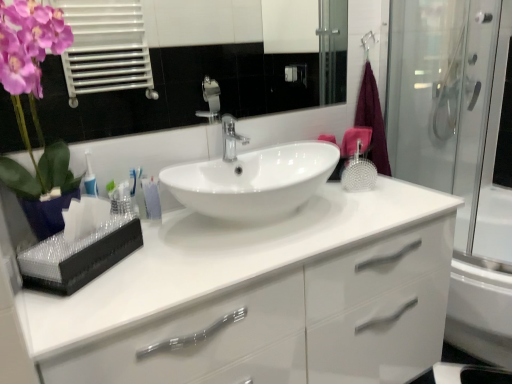
What is the approximate width of translucent plastic toothbrushes at left?

The width of translucent plastic toothbrushes at left is 1.85 inches.

This screenshot has height=384, width=512. What do you see at coordinates (455, 112) in the screenshot?
I see `transparent glass shower door at right` at bounding box center [455, 112].

In order to face white glossy cabinet at center, should I rotate leftwards or rightwards?

You should rotate right by 1.140 degrees.

The width and height of the screenshot is (512, 384). Describe the element at coordinates (252, 178) in the screenshot. I see `white glossy sink at center` at that location.

This screenshot has width=512, height=384. Identify the location of translucent plastic toothbrushes at left. (151, 198).

This screenshot has width=512, height=384. In the image, there is a glossy ceramic mirror at upper center. What are the coordinates of `tap below it (from a real-world perspective)` in the screenshot? It's located at (231, 138).

Looking at this image, considering the sizes of objects polished chrome faucet at center and glossy ceramic mirror at upper center in the image provided, who is shorter, polished chrome faucet at center or glossy ceramic mirror at upper center?

polished chrome faucet at center is shorter.

Is polished chrome faucet at center wider than glossy ceramic mirror at upper center?

Yes, polished chrome faucet at center is wider than glossy ceramic mirror at upper center.

Who is more distant, polished chrome faucet at center or glossy ceramic mirror at upper center?

polished chrome faucet at center is behind.

From the image's perspective, is white glossy cabinet at center positioned above or below translucent plastic toothbrushes at left?

From the image's perspective, white glossy cabinet at center appears below translucent plastic toothbrushes at left.

Would you say white glossy cabinet at center is a long distance from translucent plastic toothbrushes at left?

No, there isn't a large distance between white glossy cabinet at center and translucent plastic toothbrushes at left.

Which object is positioned more to the right, white glossy cabinet at center or translucent plastic toothbrushes at left?

white glossy cabinet at center.

Between point (70, 321) and point (147, 185), which one is positioned in front?

The point (70, 321) is more forward.

Is glossy ceramic mirror at upper center bigger than transparent glass shower door at right?

Incorrect, glossy ceramic mirror at upper center is not larger than transparent glass shower door at right.

Consider the image. Could you tell me if glossy ceramic mirror at upper center is facing transparent glass shower door at right?

No, glossy ceramic mirror at upper center is not aimed at transparent glass shower door at right.

Is point (267, 81) less distant than point (449, 100)?

No, (267, 81) is behind (449, 100).

Considering the sizes of glossy ceramic mirror at upper center and transparent glass shower door at right in the image, is glossy ceramic mirror at upper center wider or thinner than transparent glass shower door at right?

In the image, glossy ceramic mirror at upper center appears to be more narrow than transparent glass shower door at right.

Is glossy ceramic mirror at upper center facing towards polished chrome faucet at center?

No, glossy ceramic mirror at upper center is not facing towards polished chrome faucet at center.

Consider the image. From the image's perspective, which one is positioned higher, glossy ceramic mirror at upper center or polished chrome faucet at center?

From the image's view, glossy ceramic mirror at upper center is above.

Considering the points (269, 102) and (242, 142), which point is in front, point (269, 102) or point (242, 142)?

Positioned in front is point (242, 142).

Is polished chrome faucet at center oriented away from maroon fabric bath towel at right?

No.

In the scene shown: Measure the distance between polished chrome faucet at center and maroon fabric bath towel at right.

polished chrome faucet at center and maroon fabric bath towel at right are 20.63 inches apart.

Is polished chrome faucet at center inside or outside of maroon fabric bath towel at right?

polished chrome faucet at center lies outside maroon fabric bath towel at right.

Is polished chrome faucet at center beside maroon fabric bath towel at right?

They are not placed beside each other.

Is transparent glass shower door at right aimed at maroon fabric bath towel at right?

Yes, transparent glass shower door at right faces towards maroon fabric bath towel at right.

What's the angular difference between transparent glass shower door at right and maroon fabric bath towel at right's facing directions?

90.8 degrees.

In the image, is transparent glass shower door at right on the left side or the right side of maroon fabric bath towel at right?

In the image, transparent glass shower door at right appears on the right side of maroon fabric bath towel at right.

Is point (437, 61) positioned behind point (374, 144)?

Yes, it is behind point (374, 144).

From a real-world perspective, which object rests below the other?

white glossy sink at center is physically lower.

Considering the relative sizes of white glossy sink at center and transparent glass shower door at right in the image provided, is white glossy sink at center thinner than transparent glass shower door at right?

Indeed, white glossy sink at center has a lesser width compared to transparent glass shower door at right.

Is white glossy sink at center shorter than transparent glass shower door at right?

Yes.

Are white glossy sink at center and transparent glass shower door at right far apart?

They are positioned close to each other.

This screenshot has width=512, height=384. I want to click on mirror above the polished chrome faucet at center (from a real-world perspective), so click(192, 64).

Locate an element on the screen. bathroom cabinet in front of the translucent plastic toothbrushes at left is located at coordinates (263, 297).

Based on the photo, considering their positions, is white glossy cabinet at center positioned closer to white glossy sink at center than transparent glass shower door at right?

white glossy cabinet at center is closer to white glossy sink at center.

Estimate the real-world distances between objects in this image. Which object is closer to polished chrome faucet at center, white glossy sink at center or translucent plastic toothbrushes at left?

white glossy sink at center is closer to polished chrome faucet at center.

From the image, which object appears to be nearer to white glossy cabinet at center, translucent plastic toothbrushes at left or polished chrome faucet at center?

translucent plastic toothbrushes at left is positioned closer to the anchor white glossy cabinet at center.

When comparing their distances from white glossy cabinet at center, does polished chrome faucet at center or white glossy sink at center seem closer?

white glossy sink at center lies closer to white glossy cabinet at center than the other object.

Based on the photo, which object lies further to the anchor point white glossy cabinet at center, white glossy sink at center or maroon fabric bath towel at right?

Among the two, maroon fabric bath towel at right is located further to white glossy cabinet at center.

Considering their positions, is maroon fabric bath towel at right positioned closer to translucent plastic toothbrushes at left than transparent glass shower door at right?

The object closer to translucent plastic toothbrushes at left is maroon fabric bath towel at right.

Which object lies nearer to the anchor point glossy ceramic mirror at upper center, maroon fabric bath towel at right or transparent glass shower door at right?

transparent glass shower door at right is closer to glossy ceramic mirror at upper center.

Estimate the real-world distances between objects in this image. Which object is further from white glossy sink at center, maroon fabric bath towel at right or transparent glass shower door at right?

Based on the image, transparent glass shower door at right appears to be further to white glossy sink at center.

Locate an element on the screen. The height and width of the screenshot is (384, 512). sink between glossy ceramic mirror at upper center and white glossy cabinet at center in the vertical direction is located at coordinates (252, 178).

I want to click on bath towel between glossy ceramic mirror at upper center and white glossy cabinet at center in the vertical direction, so click(372, 120).

This screenshot has width=512, height=384. I want to click on sink situated between glossy ceramic mirror at upper center and maroon fabric bath towel at right from left to right, so click(252, 178).

This screenshot has height=384, width=512. I want to click on bathroom cabinet situated between translucent plastic toothbrushes at left and maroon fabric bath towel at right from left to right, so click(x=263, y=297).